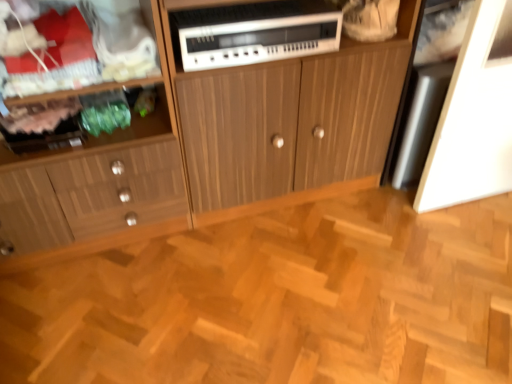
Identify the location of free point above natural wood parquet floor at center (from a real-world perspective). The height and width of the screenshot is (384, 512). (306, 281).